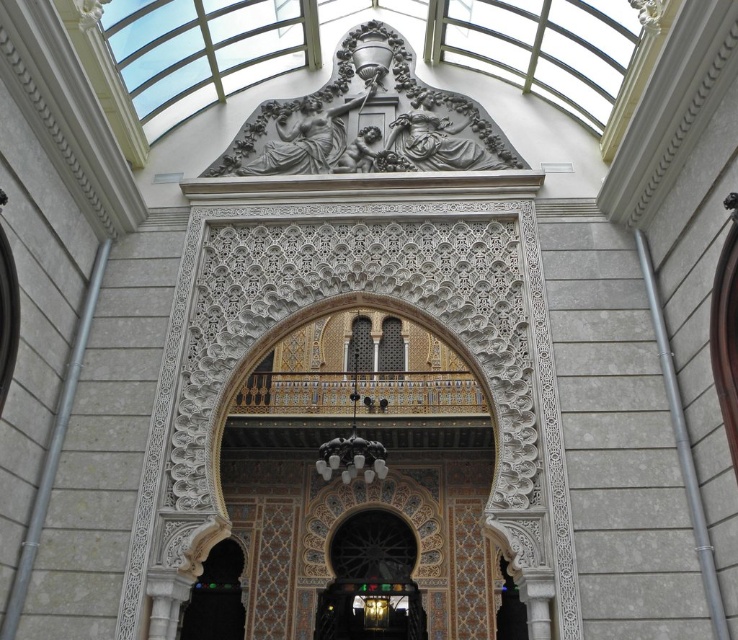
Question: Which point is closer to the camera?

Choices:
 (A) gold mosaic balustrade at center
 (B) gray stone relief at upper center
 (C) metallic gold door at lower center
 (D) dark wood door at lower left

Answer: (D)

Question: Is gray stone relief at upper center to the left of metallic gold door at lower center from the viewer's perspective?

Choices:
 (A) yes
 (B) no

Answer: (A)

Question: Is metallic gold door at lower center further to camera compared to dark wood door at lower left?

Choices:
 (A) no
 (B) yes

Answer: (B)

Question: Is gray stone relief at upper center further to the viewer compared to metallic gold door at lower center?

Choices:
 (A) yes
 (B) no

Answer: (B)

Question: Which object is farther from the camera taking this photo?

Choices:
 (A) metallic gold door at lower center
 (B) gold mosaic balustrade at center
 (C) gray stone relief at upper center

Answer: (A)

Question: Which of the following is the closest to the observer?

Choices:
 (A) (204, 600)
 (B) (461, 140)
 (C) (341, 388)
 (D) (325, 628)

Answer: (B)